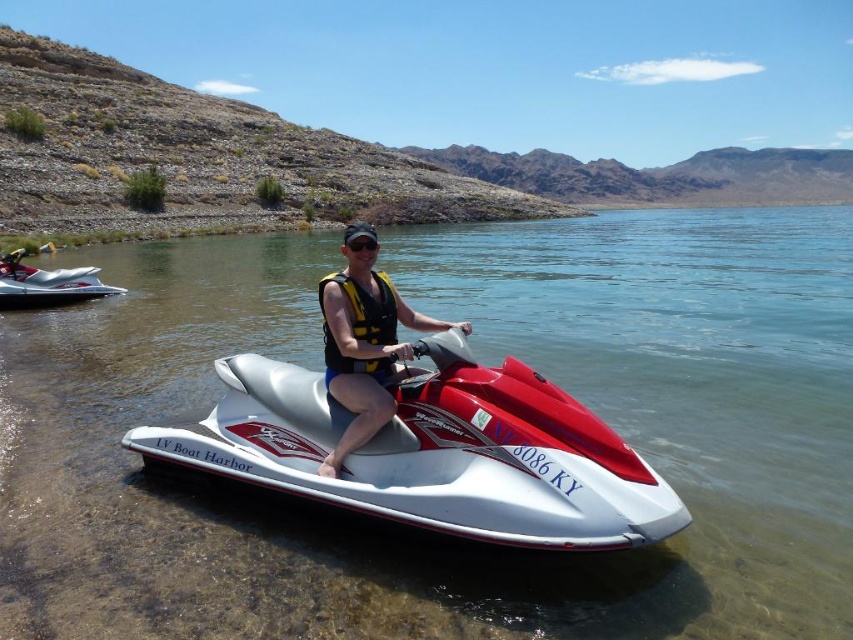
Question: In this image, where is matte yellow life vest at center located relative to yellow/textured life jacket at center?

Choices:
 (A) above
 (B) below

Answer: (B)

Question: Among these points, which one is nearest to the camera?

Choices:
 (A) (573, 400)
 (B) (744, 417)

Answer: (A)

Question: Among these objects, which one is farthest from the camera?

Choices:
 (A) white glossy jet ski at center
 (B) white glossy water at center

Answer: (B)

Question: In this image, where is matte yellow life vest at center located relative to yellow/textured life jacket at center?

Choices:
 (A) left
 (B) right

Answer: (B)

Question: Does white glossy jet ski at center appear on the left side of yellow/textured life jacket at center?

Choices:
 (A) yes
 (B) no

Answer: (A)

Question: Which point is closer to the camera?

Choices:
 (A) white glossy jet ski at center
 (B) white glossy water at center

Answer: (A)